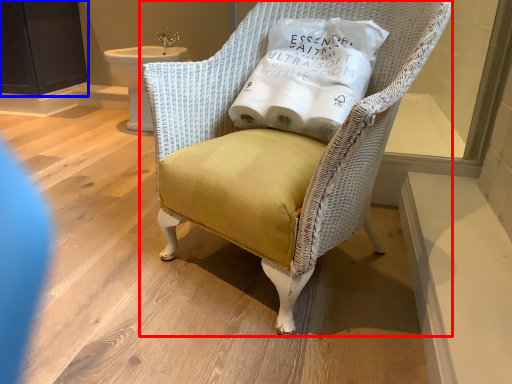
Question: Among these objects, which one is farthest to the camera, chair (highlighted by a red box) or screen door (highlighted by a blue box)?

Choices:
 (A) chair
 (B) screen door

Answer: (B)